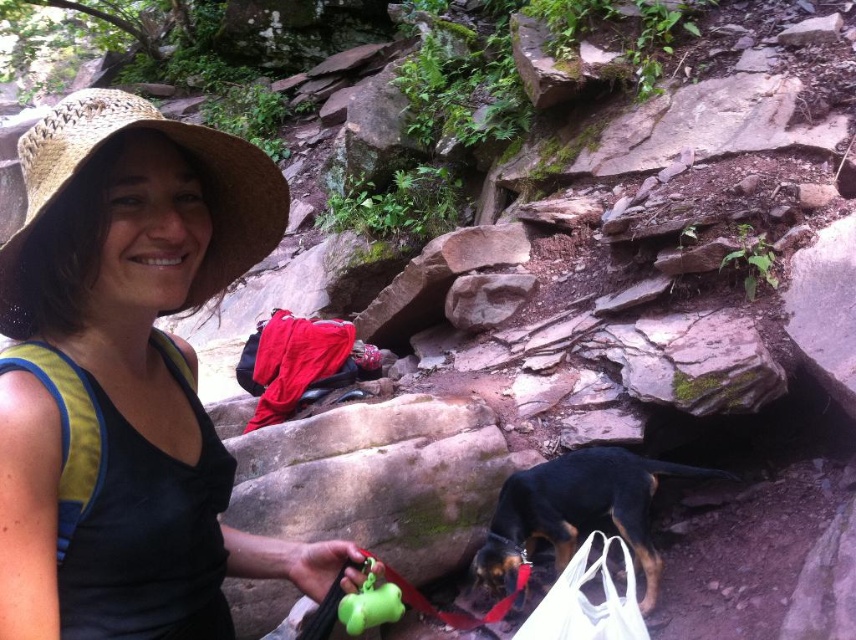
Question: Which of the following is the farthest from the observer?

Choices:
 (A) natural straw hat at upper left
 (B) straw hat at upper left

Answer: (B)

Question: Can you confirm if natural straw hat at upper left is positioned to the right of black and tan fur dog at lower right?

Choices:
 (A) no
 (B) yes

Answer: (A)

Question: Which point is closer to the camera taking this photo?

Choices:
 (A) (584, 563)
 (B) (34, 176)
 (C) (681, 474)
 (D) (256, 257)

Answer: (B)

Question: Which object is closer to the camera taking this photo?

Choices:
 (A) black and tan fur dog at lower right
 (B) straw hat at upper left

Answer: (B)

Question: Is the position of straw hat at upper left more distant than that of white fabric bag at lower right?

Choices:
 (A) yes
 (B) no

Answer: (B)

Question: Is black and tan fur dog at lower right smaller than white fabric bag at lower right?

Choices:
 (A) no
 (B) yes

Answer: (A)